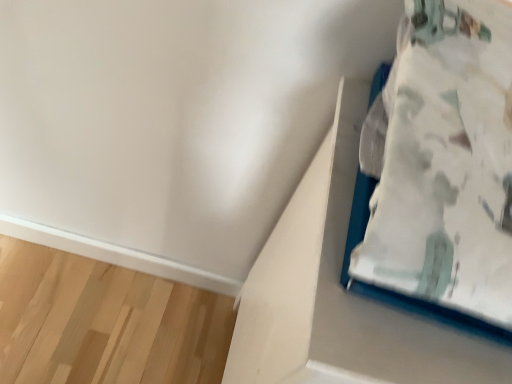
Question: In terms of size, does white matte cardboard box at upper right appear bigger or smaller than white fabric bed at upper right?

Choices:
 (A) small
 (B) big

Answer: (B)

Question: Looking at their shapes, would you say white matte cardboard box at upper right is wider or thinner than white fabric bed at upper right?

Choices:
 (A) wide
 (B) thin

Answer: (A)

Question: From a real-world perspective, is white matte cardboard box at upper right physically located above or below white fabric bed at upper right?

Choices:
 (A) above
 (B) below

Answer: (B)

Question: Looking at their shapes, would you say white fabric bed at upper right is wider or thinner than white matte cardboard box at upper right?

Choices:
 (A) wide
 (B) thin

Answer: (B)

Question: From the image's perspective, is white fabric bed at upper right located above or below white matte cardboard box at upper right?

Choices:
 (A) above
 (B) below

Answer: (A)

Question: In terms of height, does white fabric bed at upper right look taller or shorter compared to white matte cardboard box at upper right?

Choices:
 (A) tall
 (B) short

Answer: (B)

Question: Considering the positions of white fabric bed at upper right and white matte cardboard box at upper right in the image, is white fabric bed at upper right bigger or smaller than white matte cardboard box at upper right?

Choices:
 (A) big
 (B) small

Answer: (B)